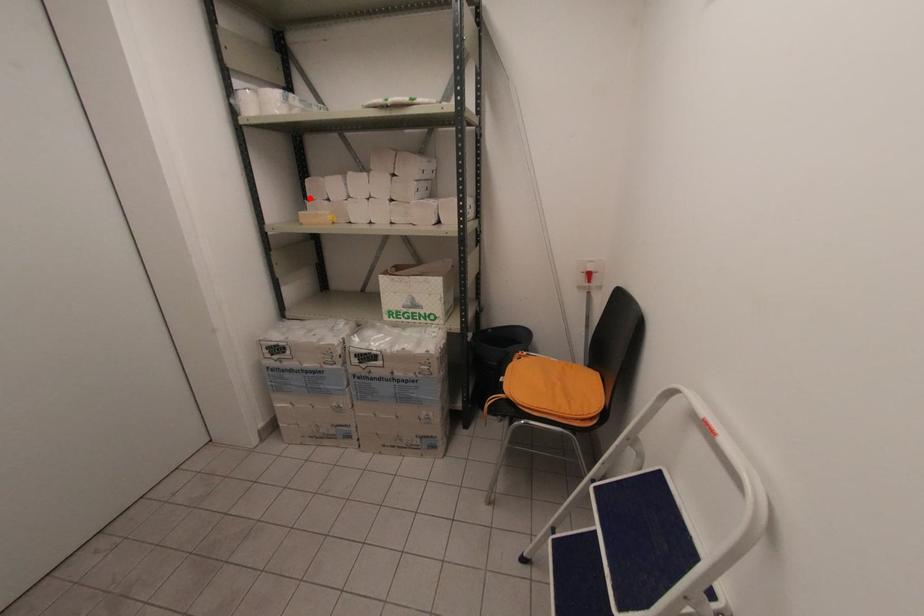
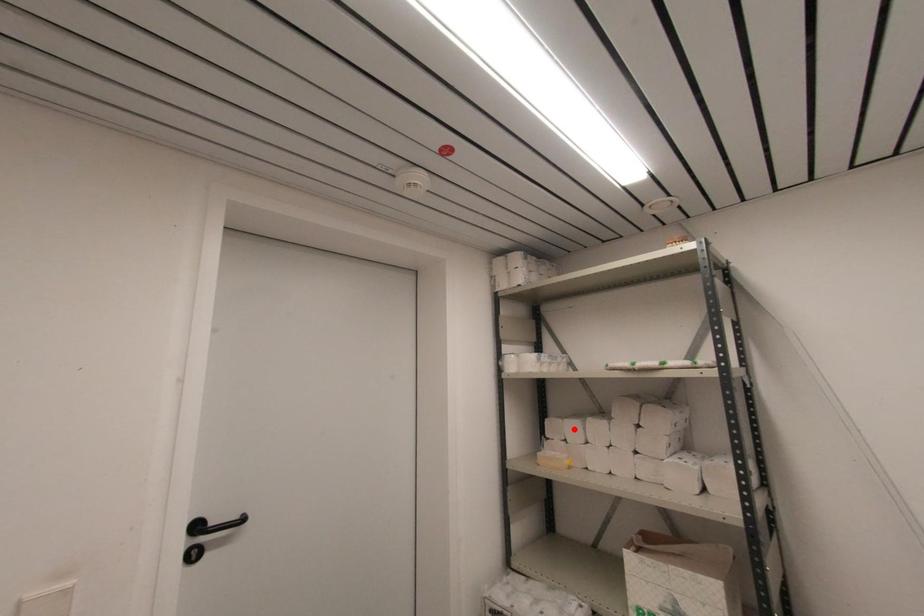
I am providing you with two images of the same scene from different viewpoints. A red point is marked on the first image and another point is marked on the second image. Is the red point in image1 aligned with the point shown in image2?

No